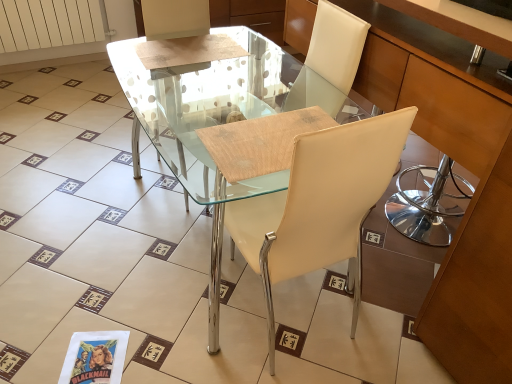
Question: Is transparent glass table at center positioned in front of matte wood cabinet at center?

Choices:
 (A) no
 (B) yes

Answer: (A)

Question: Would you say transparent glass table at center contains matte wood cabinet at center?

Choices:
 (A) no
 (B) yes

Answer: (A)

Question: Would you say transparent glass table at center is outside matte wood cabinet at center?

Choices:
 (A) no
 (B) yes

Answer: (B)

Question: Is transparent glass table at center wider than matte wood cabinet at center?

Choices:
 (A) no
 (B) yes

Answer: (B)

Question: From a real-world perspective, is transparent glass table at center under matte wood cabinet at center?

Choices:
 (A) yes
 (B) no

Answer: (A)

Question: From the image's perspective, is transparent glass table at center positioned above or below matte white chair at center?

Choices:
 (A) above
 (B) below

Answer: (A)

Question: From a real-world perspective, is transparent glass table at center positioned above or below matte white chair at center?

Choices:
 (A) below
 (B) above

Answer: (A)

Question: In terms of height, does transparent glass table at center look taller or shorter compared to matte white chair at center?

Choices:
 (A) tall
 (B) short

Answer: (B)

Question: Considering the positions of transparent glass table at center and matte white chair at center in the image, is transparent glass table at center bigger or smaller than matte white chair at center?

Choices:
 (A) small
 (B) big

Answer: (B)

Question: In terms of width, does matte white chair at center look wider or thinner when compared to white matte radiator at upper left?

Choices:
 (A) thin
 (B) wide

Answer: (B)

Question: Is point (250, 233) positioned closer to the camera than point (74, 13)?

Choices:
 (A) closer
 (B) farther

Answer: (A)

Question: Is matte white chair at center in front of or behind white matte radiator at upper left in the image?

Choices:
 (A) front
 (B) behind

Answer: (A)

Question: From their relative heights in the image, would you say matte white chair at center is taller or shorter than white matte radiator at upper left?

Choices:
 (A) short
 (B) tall

Answer: (B)

Question: From a real-world perspective, relative to matte wood cabinet at center, is transparent glass table at center vertically above or below?

Choices:
 (A) above
 (B) below

Answer: (B)

Question: Is transparent glass table at center to the left or to the right of matte wood cabinet at center in the image?

Choices:
 (A) right
 (B) left

Answer: (B)